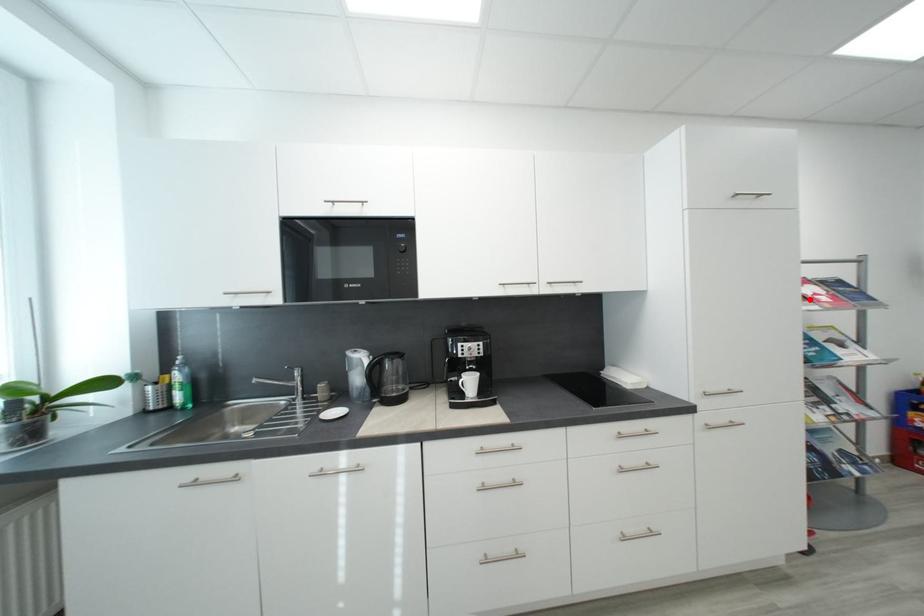
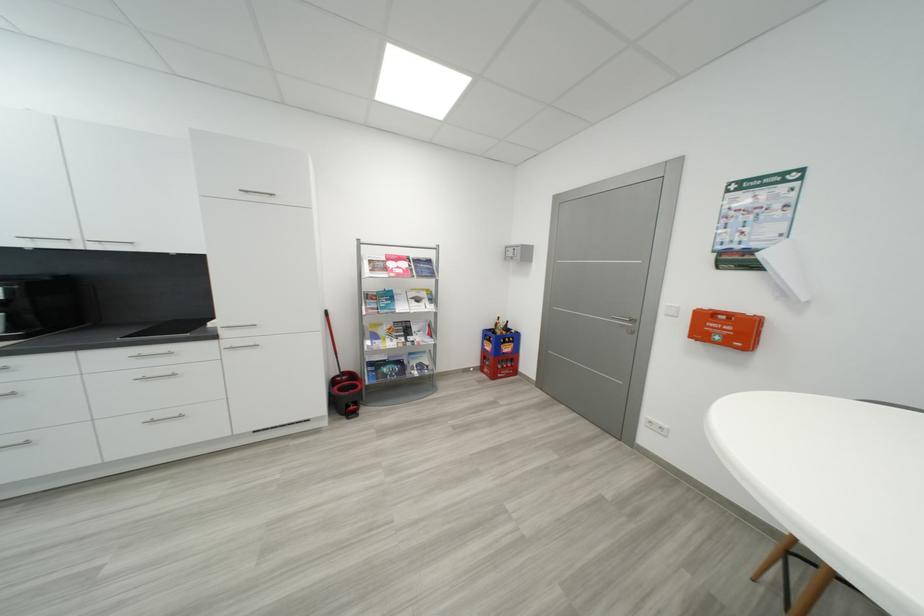
Find the pixel in the second image that matches the highlighted location in the first image.

(393, 270)